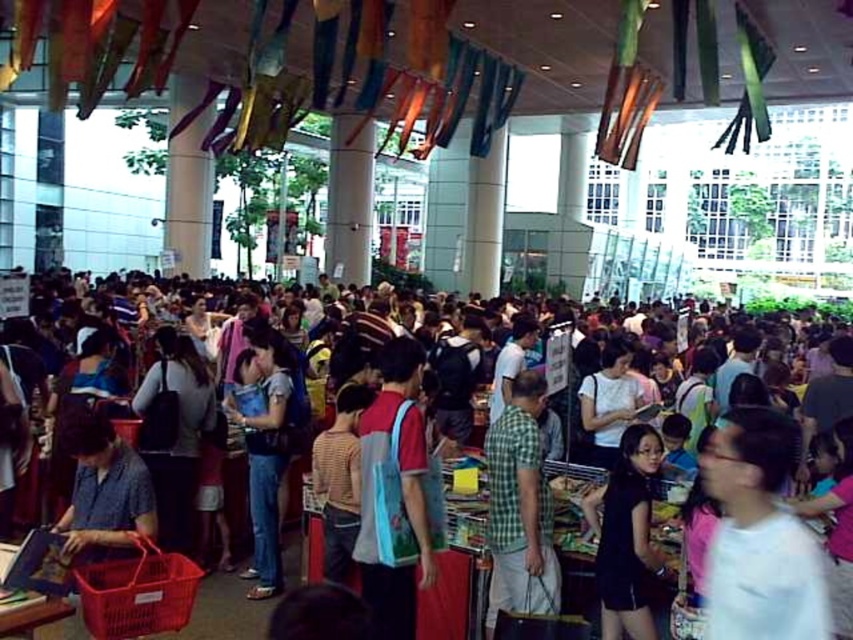
You are a photographer at the market and want to take a photo of the green plaid shirt at center and the black matte dress at lower right. Which one should you focus on first if you want to capture both in the frame without moving the camera?

The green plaid shirt at center is much taller than the black matte dress at lower right, so you should focus on the green plaid shirt at center first to ensure it fits within the frame.

You are a shopper who just finished buying groceries and need to place your matte plastic bags at center into a storage bin located at the far end of the market. The storage bin is 4 meters away from your current position. Can you reach the bin without moving the bags?

The matte plastic bags at center are 3.76 meters apart from each other, but the distance from your current position to the storage bin is 4 meters. Since the bags themselves are only 3.76 meters apart, you would need to move them or take a different path to reach the bin.